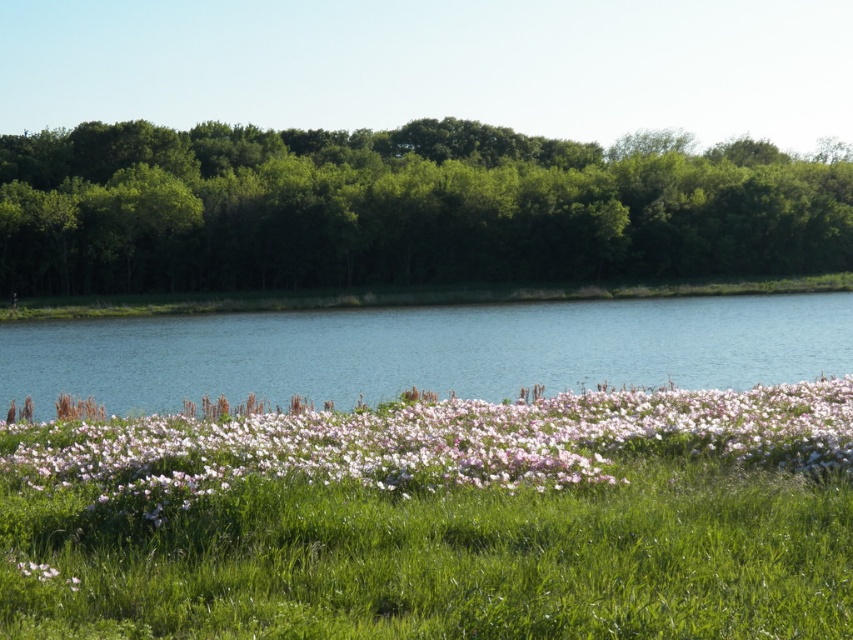
Looking at this image, is blue water at center above pink matte flowers at center?

Indeed, blue water at center is positioned over pink matte flowers at center.

Does blue water at center appear under pink matte flowers at center?

No, blue water at center is not below pink matte flowers at center.

The image size is (853, 640). Find the location of `blue water at center`. blue water at center is located at coordinates (426, 349).

How distant is green leafy trees at upper center from pink matte flowers at center?

They are 103.88 meters apart.

Which is behind, point (618, 186) or point (849, 422)?

Positioned behind is point (618, 186).

Where is `green leafy trees at upper center`? The image size is (853, 640). green leafy trees at upper center is located at coordinates (398, 209).

The height and width of the screenshot is (640, 853). I want to click on green leafy trees at upper center, so click(x=398, y=209).

Which is above, green leafy trees at upper center or blue water at center?

green leafy trees at upper center is higher up.

Does green leafy trees at upper center have a larger size compared to blue water at center?

Indeed, green leafy trees at upper center has a larger size compared to blue water at center.

Locate an element on the screen. green leafy trees at upper center is located at coordinates (398, 209).

The height and width of the screenshot is (640, 853). I want to click on green leafy trees at upper center, so click(x=398, y=209).